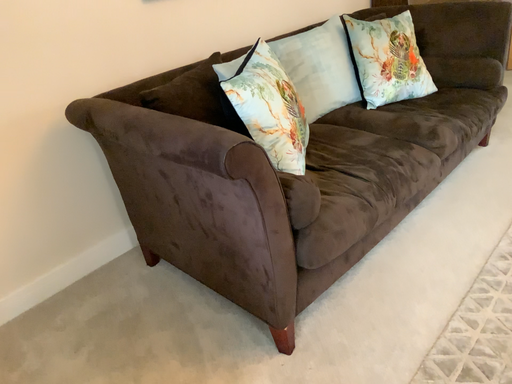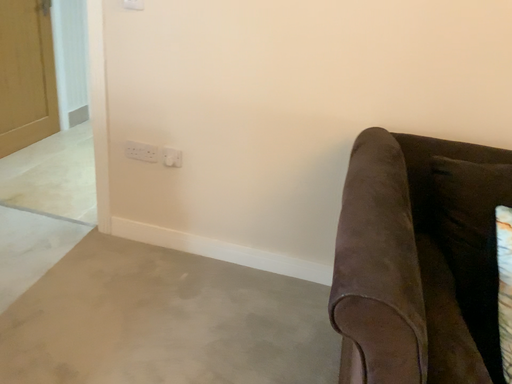
Question: How did the camera likely rotate when shooting the video?

Choices:
 (A) rotated right
 (B) rotated left

Answer: (B)